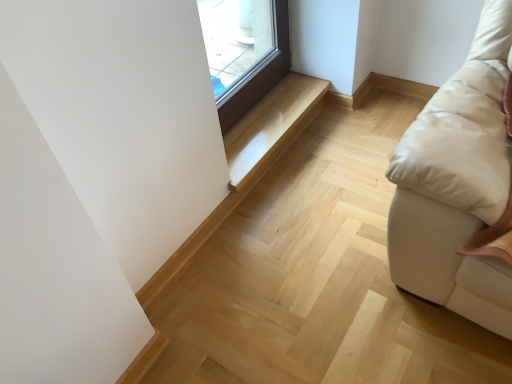
Question: From the image's perspective, is light wood stairwell at center, marked as the first stairwell in a bottom-to-top arrangement, over glossy wood bench at center, which appears as the second stairwell when ordered from the bottom?

Choices:
 (A) yes
 (B) no

Answer: (B)

Question: Is light wood stairwell at center, placed as the second stairwell when sorted from top to bottom, surrounding glossy wood bench at center, which appears as the second stairwell when ordered from the bottom?

Choices:
 (A) yes
 (B) no

Answer: (B)

Question: From a real-world perspective, is light wood stairwell at center, marked as the first stairwell in a bottom-to-top arrangement, physically below glossy wood bench at center, arranged as the 1th stairwell when viewed from the top?

Choices:
 (A) yes
 (B) no

Answer: (A)

Question: Is light wood stairwell at center, placed as the second stairwell when sorted from top to bottom, not inside glossy wood bench at center, which appears as the second stairwell when ordered from the bottom?

Choices:
 (A) yes
 (B) no

Answer: (A)

Question: Can you confirm if light wood stairwell at center, placed as the second stairwell when sorted from top to bottom, is shorter than glossy wood bench at center, which appears as the second stairwell when ordered from the bottom?

Choices:
 (A) yes
 (B) no

Answer: (B)

Question: Is light wood stairwell at center, marked as the first stairwell in a bottom-to-top arrangement, wider than glossy wood bench at center, arranged as the 1th stairwell when viewed from the top?

Choices:
 (A) no
 (B) yes

Answer: (A)

Question: From the image's perspective, is glossy wood bench at center, which appears as the second stairwell when ordered from the bottom, beneath light wood stairwell at center, placed as the second stairwell when sorted from top to bottom?

Choices:
 (A) no
 (B) yes

Answer: (A)

Question: Can you confirm if glossy wood bench at center, arranged as the 1th stairwell when viewed from the top, is thinner than light wood stairwell at center, placed as the second stairwell when sorted from top to bottom?

Choices:
 (A) no
 (B) yes

Answer: (A)

Question: From a real-world perspective, is glossy wood bench at center, which appears as the second stairwell when ordered from the bottom, positioned under light wood stairwell at center, placed as the second stairwell when sorted from top to bottom, based on gravity?

Choices:
 (A) no
 (B) yes

Answer: (A)

Question: From the image's perspective, does glossy wood bench at center, arranged as the 1th stairwell when viewed from the top, appear higher than light wood stairwell at center, marked as the first stairwell in a bottom-to-top arrangement?

Choices:
 (A) yes
 (B) no

Answer: (A)

Question: Can you confirm if glossy wood bench at center, which appears as the second stairwell when ordered from the bottom, is smaller than light wood stairwell at center, marked as the first stairwell in a bottom-to-top arrangement?

Choices:
 (A) no
 (B) yes

Answer: (A)

Question: Can you confirm if glossy wood bench at center, which appears as the second stairwell when ordered from the bottom, is wider than light wood stairwell at center, placed as the second stairwell when sorted from top to bottom?

Choices:
 (A) no
 (B) yes

Answer: (B)

Question: Is glossy wood bench at center, arranged as the 1th stairwell when viewed from the top, situated inside light wood stairwell at center, marked as the first stairwell in a bottom-to-top arrangement, or outside?

Choices:
 (A) outside
 (B) inside

Answer: (A)